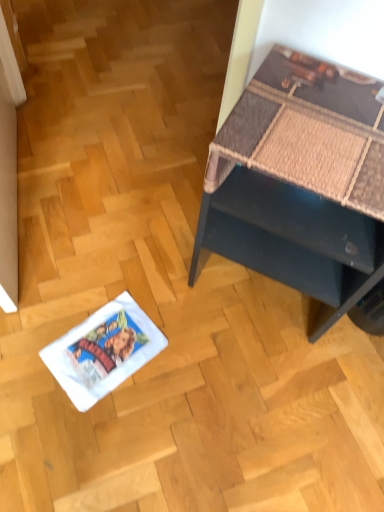
This screenshot has height=512, width=384. What are the coordinates of `free region on the left part of dark blue textured desk at upper right` in the screenshot? It's located at (137, 272).